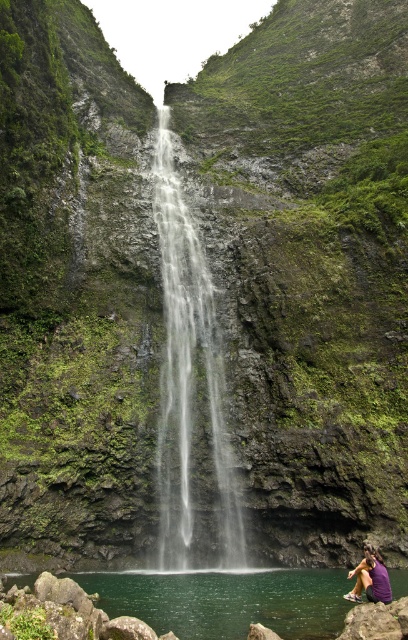
Which is behind, point (214, 445) or point (383, 582)?

Positioned behind is point (214, 445).

Which is above, clear water at center or purple fabric at lower right?

Positioned higher is clear water at center.

Between point (192, 525) and point (367, 561), which one is positioned in front?

Point (367, 561) is more forward.

Identify the location of clear water at center. The height and width of the screenshot is (640, 408). (188, 381).

Who is lower down, clear water at center or green liquid water at lower center?

green liquid water at lower center

Is point (181, 442) farther from camera compared to point (232, 579)?

Yes, it is behind point (232, 579).

Which is behind, point (232, 515) or point (195, 580)?

Point (232, 515)

I want to click on clear water at center, so [188, 381].

Who is positioned more to the left, green liquid water at lower center or purple fabric at lower right?

Positioned to the left is green liquid water at lower center.

The image size is (408, 640). I want to click on green liquid water at lower center, so click(226, 600).

Image resolution: width=408 pixels, height=640 pixels. I want to click on green liquid water at lower center, so click(x=226, y=600).